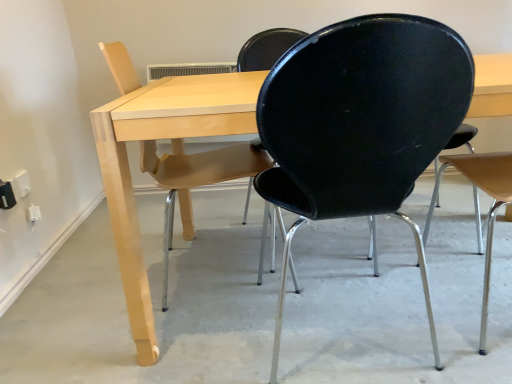
Find the location of a particular element. The image size is (512, 384). vacant space to the left of matte wood chair at left, the 3th chair positioned from the right is located at coordinates (82, 297).